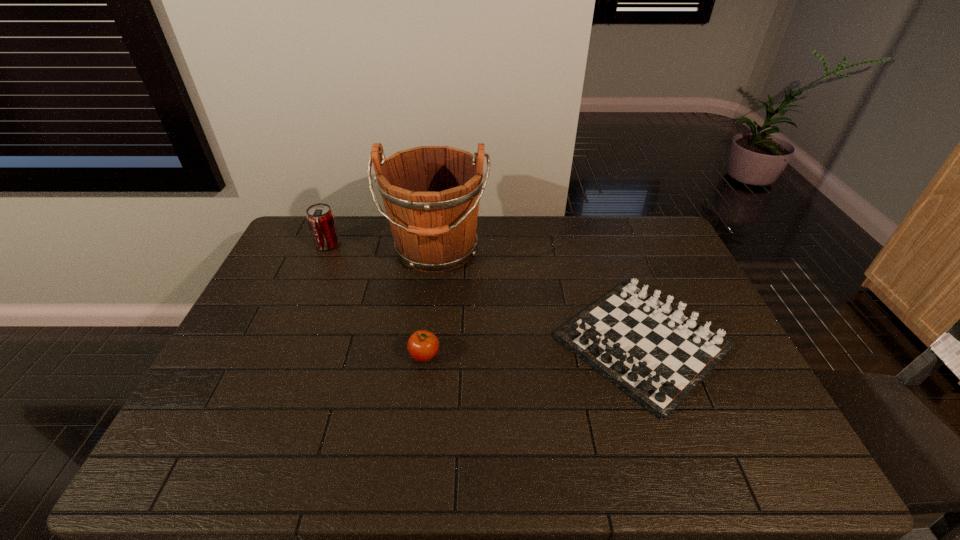
Identify which object is the third closest to the bucket. Please provide its 2D coordinates. Your answer should be formatted as a tuple, i.e. [(x, y)], where the tuple contains the x and y coordinates of a point satisfying the conditions above.

[(423, 345)]

Choose which object is the nearest neighbor to the bucket. Please provide its 2D coordinates. Your answer should be formatted as a tuple, i.e. [(x, y)], where the tuple contains the x and y coordinates of a point satisfying the conditions above.

[(320, 217)]

Locate an element on the screen. free point that satisfies the following two spatial constraints: 1. with the handle on the side of the apple; 2. on the left side of the tallest object is located at coordinates (423, 356).

Locate an element on the screen. This screenshot has height=540, width=960. free location that satisfies the following two spatial constraints: 1. with the handle on the side of the bucket; 2. on the left side of the second shortest object is located at coordinates (423, 356).

Identify the location of free location that satisfies the following two spatial constraints: 1. with the handle on the side of the apple; 2. on the left side of the bucket. (423, 356).

Locate an element on the screen. free space that satisfies the following two spatial constraints: 1. with the handle on the side of the shortest object; 2. on the right side of the bucket is located at coordinates (425, 342).